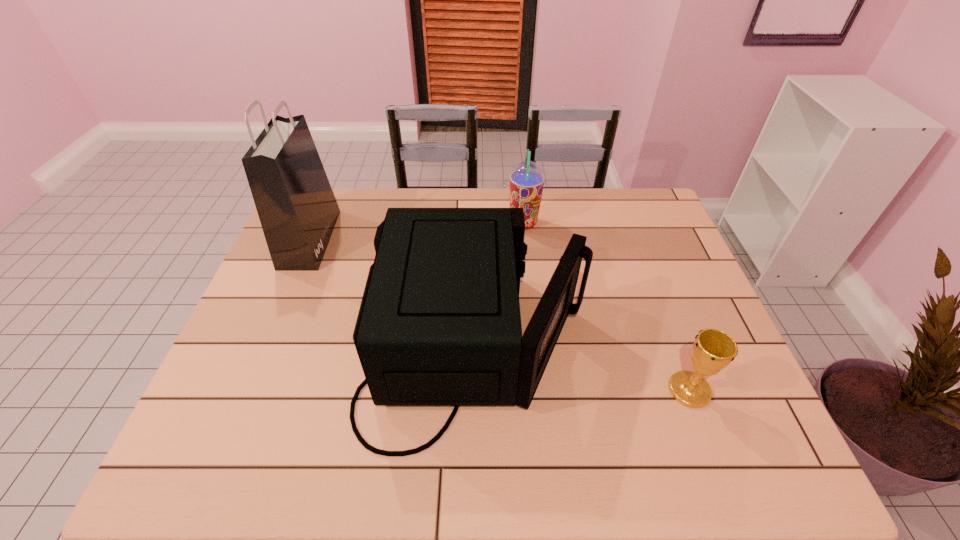
Locate an element on the screen. This screenshot has width=960, height=540. shopping bag at the far edge is located at coordinates (297, 209).

Where is `smoothie present at the far edge`? smoothie present at the far edge is located at coordinates (527, 179).

This screenshot has height=540, width=960. I want to click on object present at the near edge, so click(x=439, y=324).

At what (x,y) coordinates should I click in order to perform the action: click on object present at the left edge. Please return your answer as a coordinate pair (x, y). Looking at the image, I should click on (297, 209).

The height and width of the screenshot is (540, 960). Identify the location of object that is positioned at the right edge. (713, 350).

Where is `object that is positioned at the far left corner`? This screenshot has height=540, width=960. object that is positioned at the far left corner is located at coordinates (297, 209).

The image size is (960, 540). In the image, there is a desktop. What are the coordinates of `vacant space at the far edge` in the screenshot? It's located at pos(496,197).

Image resolution: width=960 pixels, height=540 pixels. In the image, there is a desktop. Identify the location of free space at the near edge. (458, 457).

Find the location of a particular element. free space at the right edge of the desktop is located at coordinates (646, 250).

Locate an element on the screen. This screenshot has width=960, height=540. vacant region between the chalice and the smoothie is located at coordinates (607, 306).